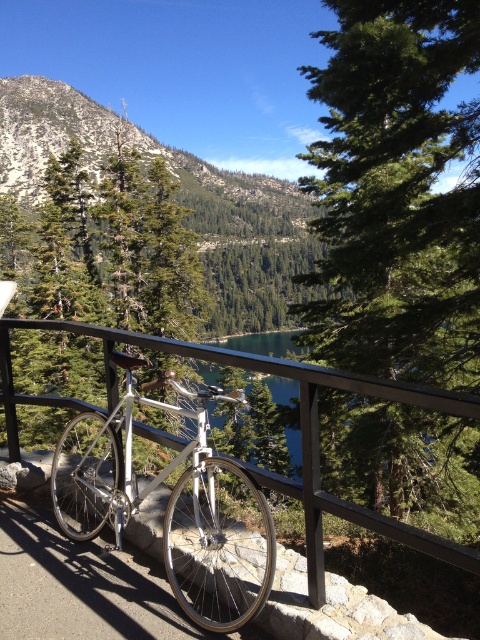
Question: Which point appears farthest from the camera in this image?

Choices:
 (A) (100, 134)
 (B) (385, 388)

Answer: (A)

Question: From the image, what is the correct spatial relationship of silver metallic bicycle at center in relation to black metal fence at center?

Choices:
 (A) below
 (B) above

Answer: (A)

Question: Estimate the real-world distances between objects in this image. Which object is farther from the black metal fence at center?

Choices:
 (A) silver metallic bicycle at center
 (B) green leafy trees at upper left

Answer: (B)

Question: Does silver metallic bicycle at center appear on the left side of black metal fence at center?

Choices:
 (A) yes
 (B) no

Answer: (A)

Question: Which of these objects is positioned closest to the silver metallic bicycle at center?

Choices:
 (A) black metal fence at center
 (B) green leafy trees at upper left

Answer: (A)

Question: Is silver metallic bicycle at center bigger than green leafy trees at upper left?

Choices:
 (A) no
 (B) yes

Answer: (A)